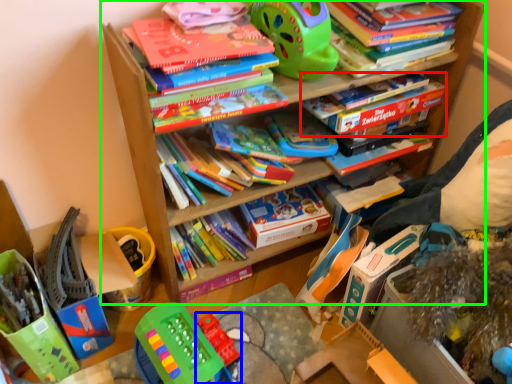
Question: Estimate the real-world distances between objects in this image. Which object is closer to book (highlighted by a red box), toy (highlighted by a blue box) or bookcase (highlighted by a green box)?

Choices:
 (A) toy
 (B) bookcase

Answer: (B)